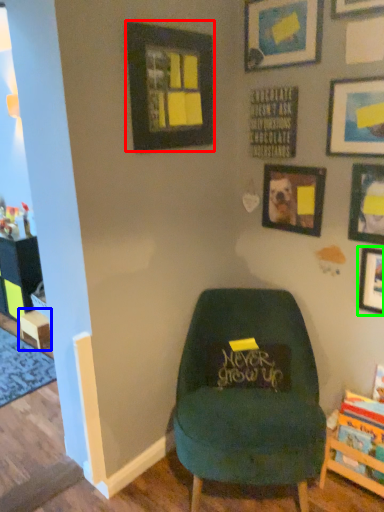
Question: Based on their relative distances, which object is nearer to picture frame (highlighted by a red box)? Choose from table (highlighted by a blue box) and picture frame (highlighted by a green box).

Choices:
 (A) table
 (B) picture frame

Answer: (B)